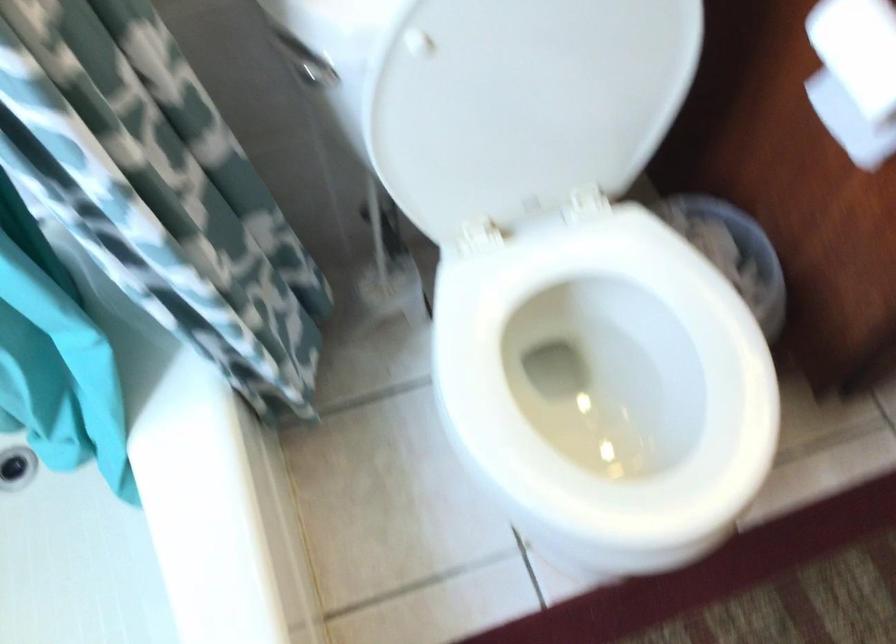
I want to click on white toilet lid, so click(528, 93).